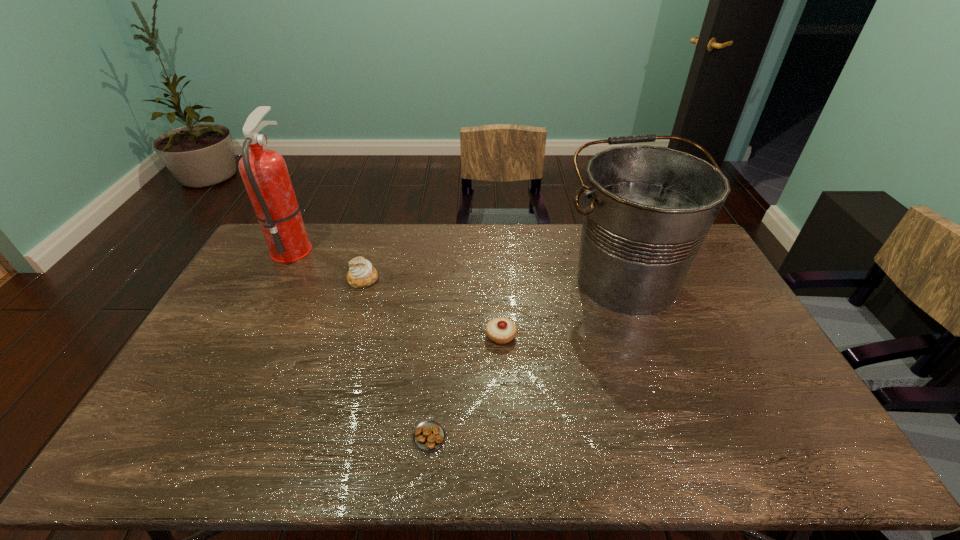
Find the location of a particular element. The image size is (960, 540). vacant point at the far edge is located at coordinates (542, 254).

In the image, there is a desktop. Where is `vacant space at the near edge`? The image size is (960, 540). vacant space at the near edge is located at coordinates (396, 444).

In the image, there is a desktop. What are the coordinates of `vacant area at the left edge` in the screenshot? It's located at (197, 384).

Identify the location of vacant space at the right edge of the desktop. (736, 367).

The height and width of the screenshot is (540, 960). Identify the location of free space between the farthest pastry and the rightmost object. (494, 280).

You are a GUI agent. You are given a task and a screenshot of the screen. Output one action in this format:
    pyautogui.click(x=<x>, y=<y>)
    Task: Click on the unoccupied position between the shortest object and the fourth object from right to left
    
    Given the screenshot: What is the action you would take?
    pyautogui.click(x=396, y=358)

Find the location of a particular element. The width and height of the screenshot is (960, 540). free spot between the second nearest pastry and the nearest pastry is located at coordinates (466, 386).

At what (x,y) coordinates should I click in order to perform the action: click on blank region between the bucket and the fire extinguisher. Please return your answer as a coordinate pair (x, y). Image resolution: width=960 pixels, height=540 pixels. Looking at the image, I should click on (459, 264).

The width and height of the screenshot is (960, 540). Identify the location of vacant area between the fourth farthest object and the second pastry from right to left. (466, 386).

This screenshot has height=540, width=960. I want to click on vacant region between the shortest pastry and the rightmost object, so click(x=527, y=359).